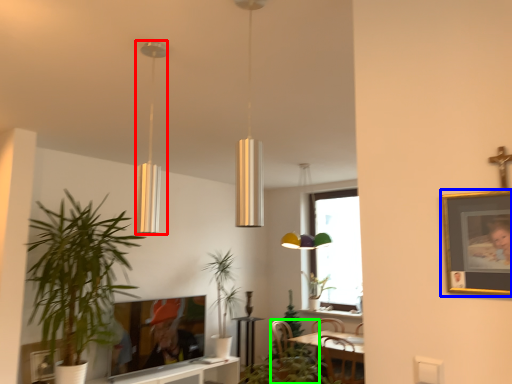
Question: Which object is the closest to the lamp (highlighted by a red box)? Choose among these: picture frame (highlighted by a blue box) or swivel chair (highlighted by a green box).

Choices:
 (A) picture frame
 (B) swivel chair

Answer: (A)